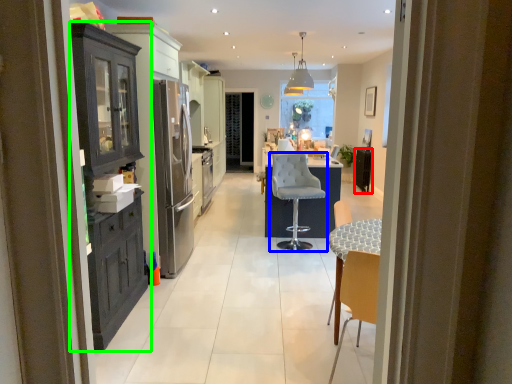
Question: Which object is the closest to the appliance (highlighted by a red box)? Choose among these: chair (highlighted by a blue box) or cabinetry (highlighted by a green box).

Choices:
 (A) chair
 (B) cabinetry

Answer: (A)